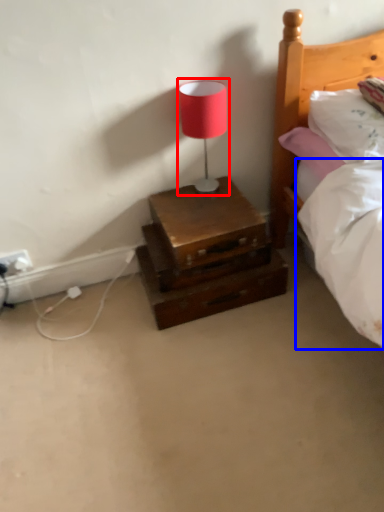
Question: Which of the following is the farthest to the observer, table lamp (highlighted by a red box) or mattress (highlighted by a blue box)?

Choices:
 (A) table lamp
 (B) mattress

Answer: (A)